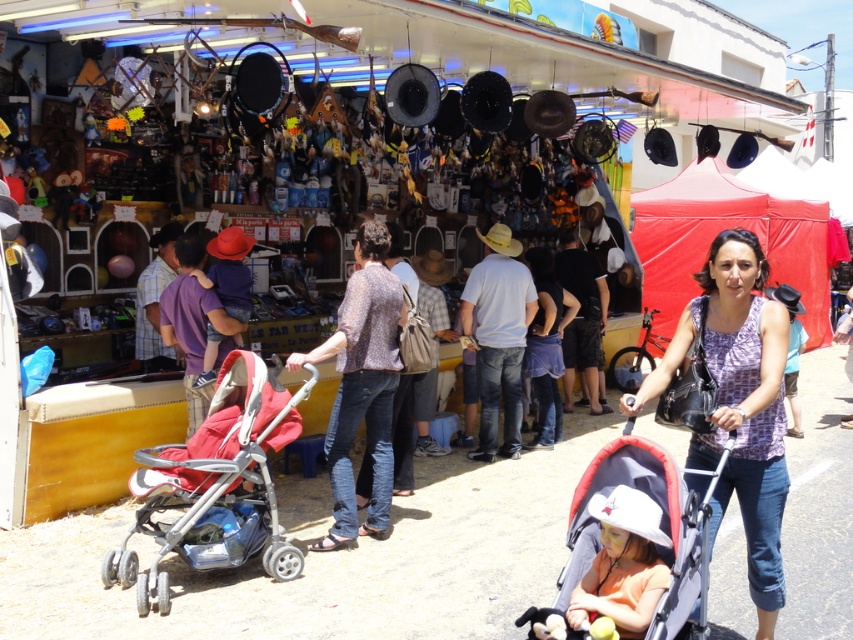
Is printed fabric blouse at center taller than gray fabric stroller at lower center?

Indeed, printed fabric blouse at center has a greater height compared to gray fabric stroller at lower center.

Who is more distant from viewer, (653, 381) or (648, 468)?

The point (653, 381) is behind.

Where is `printed fabric blouse at center`? printed fabric blouse at center is located at coordinates (738, 403).

This screenshot has width=853, height=640. What do you see at coordinates (738, 403) in the screenshot? I see `printed fabric blouse at center` at bounding box center [738, 403].

Does printed fabric blouse at center appear on the left side of red fabric stroller at center?

Incorrect, printed fabric blouse at center is not on the left side of red fabric stroller at center.

Locate an element on the screen. The height and width of the screenshot is (640, 853). printed fabric blouse at center is located at coordinates (738, 403).

Is gray fabric stroller at lower center taller than red fabric stroller at center?

No, gray fabric stroller at lower center is not taller than red fabric stroller at center.

Who is taller, gray fabric stroller at lower center or red fabric stroller at center?

With more height is red fabric stroller at center.

Who is more forward, (x=613, y=595) or (x=192, y=513)?

Point (x=613, y=595)

Find the location of a particular element. This screenshot has width=853, height=640. gray fabric stroller at lower center is located at coordinates (631, 547).